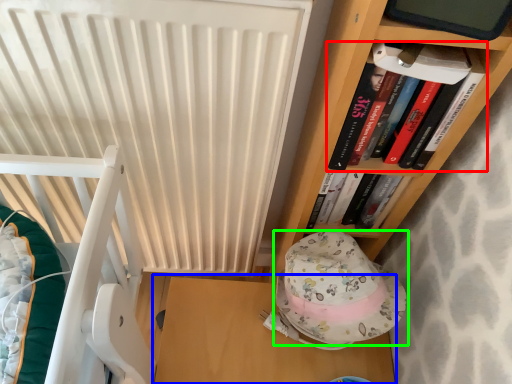
Question: Considering the real-world distances, which object is farthest from book (highlighted by a red box)? table (highlighted by a blue box) or hat (highlighted by a green box)?

Choices:
 (A) table
 (B) hat

Answer: (A)